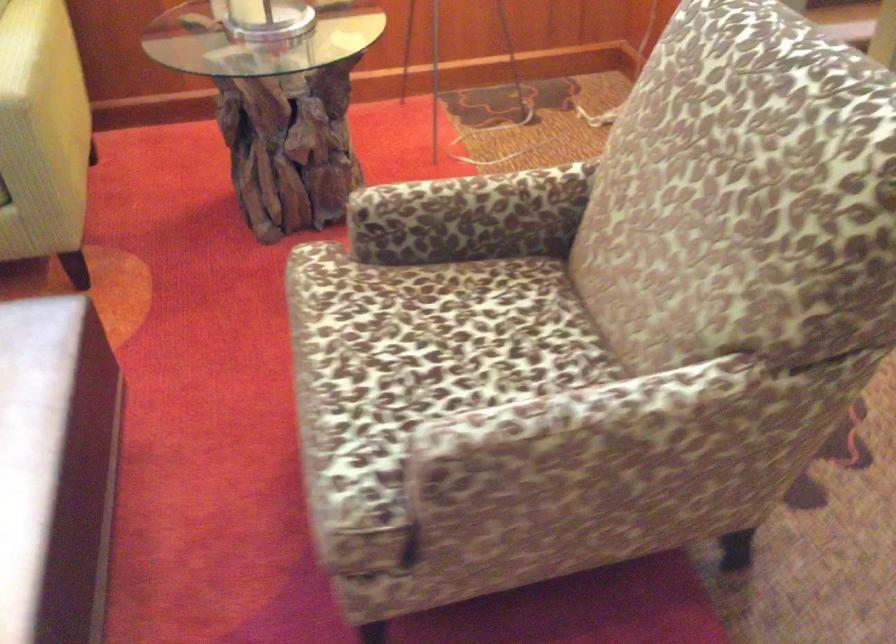
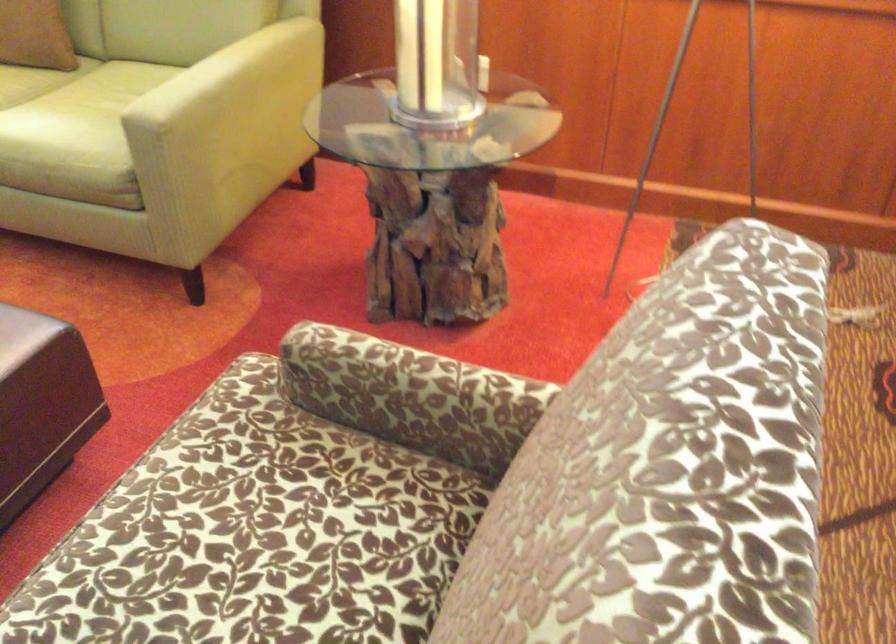
Question: The camera is either moving clockwise (left) or counter-clockwise (right) around the object. The first image is from the beginning of the video and the second image is from the end. Is the camera moving left or right when shooting the video?

Choices:
 (A) Left
 (B) Right

Answer: (B)